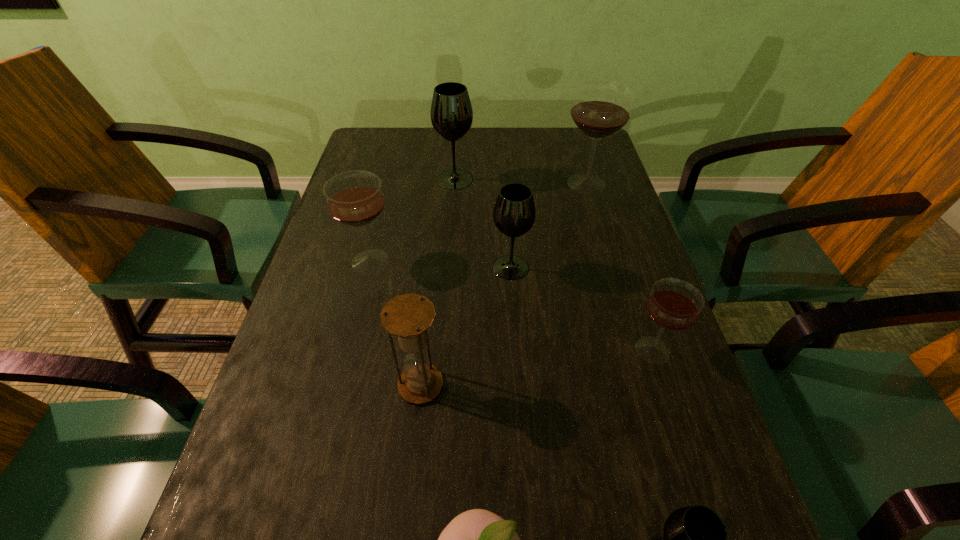
Where is `the fourth closest wineglass to the leftmost gray wineglass`? This screenshot has width=960, height=540. the fourth closest wineglass to the leftmost gray wineglass is located at coordinates (673, 304).

Select which gray wineglass is the closest to the rightmost gray wineglass. Please provide its 2D coordinates. Your answer should be formatted as a tuple, i.e. [(x, y)], where the tuple contains the x and y coordinates of a point satisfying the conditions above.

[(514, 213)]

Image resolution: width=960 pixels, height=540 pixels. Find the location of `gray wineglass that is the closest to the nearest red wineglass`. gray wineglass that is the closest to the nearest red wineglass is located at coordinates (514, 213).

Identify which red wineglass is the nearest to the leftmost red wineglass. Please provide its 2D coordinates. Your answer should be formatted as a tuple, i.e. [(x, y)], where the tuple contains the x and y coordinates of a point satisfying the conditions above.

[(601, 108)]

Find the location of `red wineglass that stands as the second closest to the leftmost object`. red wineglass that stands as the second closest to the leftmost object is located at coordinates (673, 304).